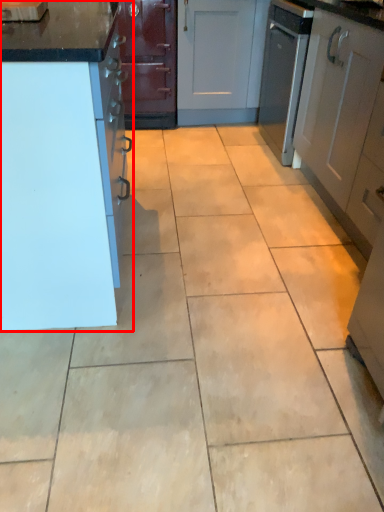
Question: From the image's perspective, where is cabinetry (annotated by the red box) located in relation to cabinetry in the image?

Choices:
 (A) above
 (B) below

Answer: (B)